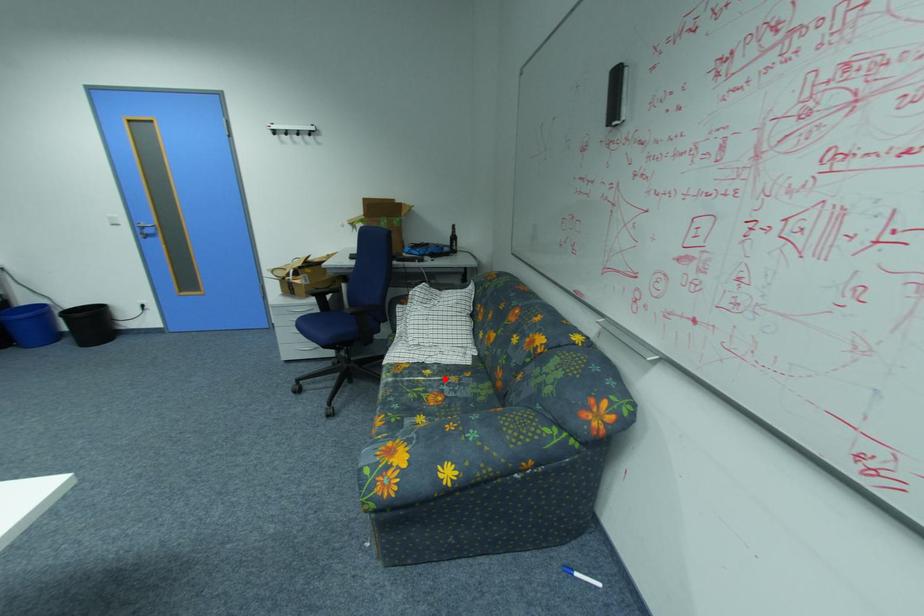
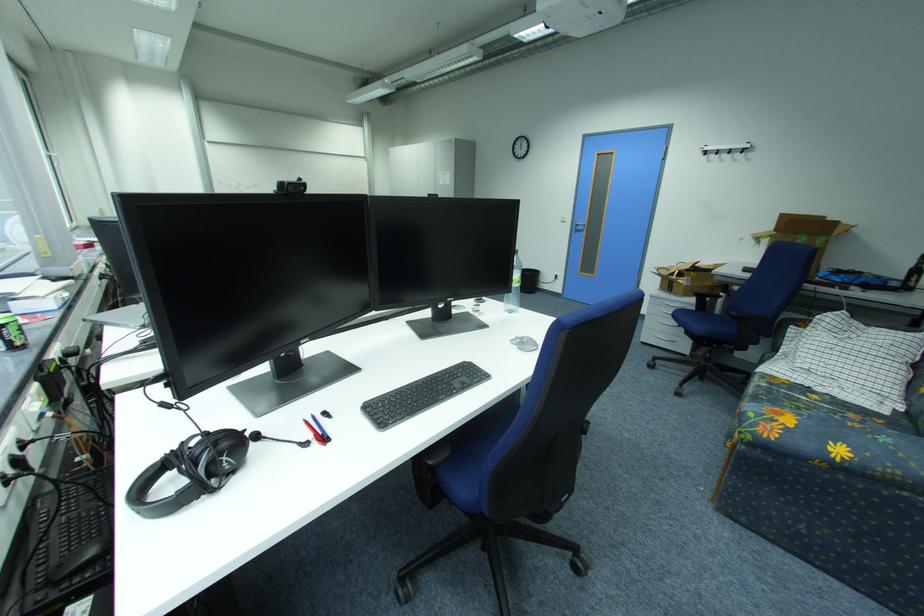
Locate, in the second image, the point that corresponds to the highlighted location in the first image.

(834, 407)